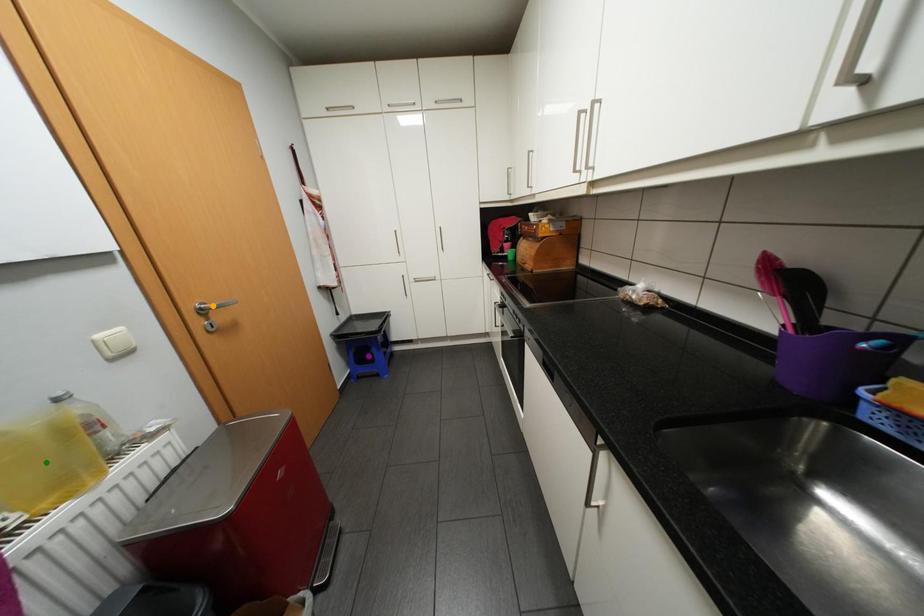
In the scene shown: Order these from nearest to farthest:
A) green point
B) purple point
C) orange point

1. green point
2. orange point
3. purple point